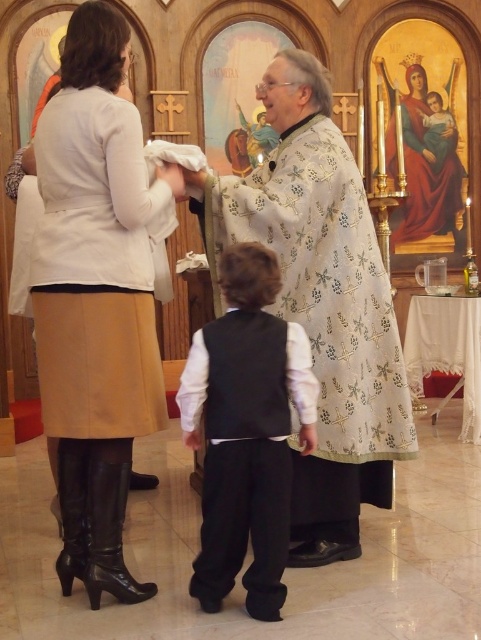
Is matte beige skirt at lower left to the left of black satin vest at center from the viewer's perspective?

Correct, you'll find matte beige skirt at lower left to the left of black satin vest at center.

Is the position of matte beige skirt at lower left more distant than that of black satin vest at center?

That is True.

Describe the element at coordinates (97, 298) in the screenshot. I see `matte beige skirt at lower left` at that location.

Where is `matte beige skirt at lower left`? This screenshot has width=481, height=640. matte beige skirt at lower left is located at coordinates (97, 298).

Can you confirm if white embroidered robe at center is positioned below black satin vest at center?

Incorrect, white embroidered robe at center is not positioned below black satin vest at center.

How distant is white embroidered robe at center from black satin vest at center?

A distance of 21.59 inches exists between white embroidered robe at center and black satin vest at center.

This screenshot has height=640, width=481. In order to click on white embroidered robe at center in this screenshot , I will do pyautogui.click(x=320, y=304).

The image size is (481, 640). In order to click on white embroidered robe at center in this screenshot , I will do pos(320,304).

Is black satin vest at center below matte gold robe at center?

Yes.

Is black satin vest at center smaller than matte gold robe at center?

Yes, black satin vest at center is smaller than matte gold robe at center.

Between point (288, 381) and point (427, 200), which one is positioned in front?

Point (288, 381) is more forward.

The width and height of the screenshot is (481, 640). Identify the location of black satin vest at center. (253, 467).